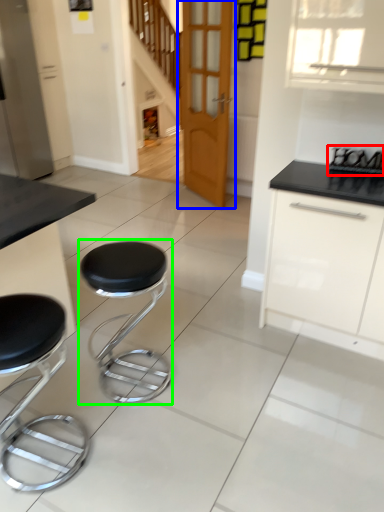
Question: Based on their relative distances, which object is farther from appliance (highlighted by a red box)? Choose from door (highlighted by a blue box) and stool (highlighted by a green box).

Choices:
 (A) door
 (B) stool

Answer: (A)